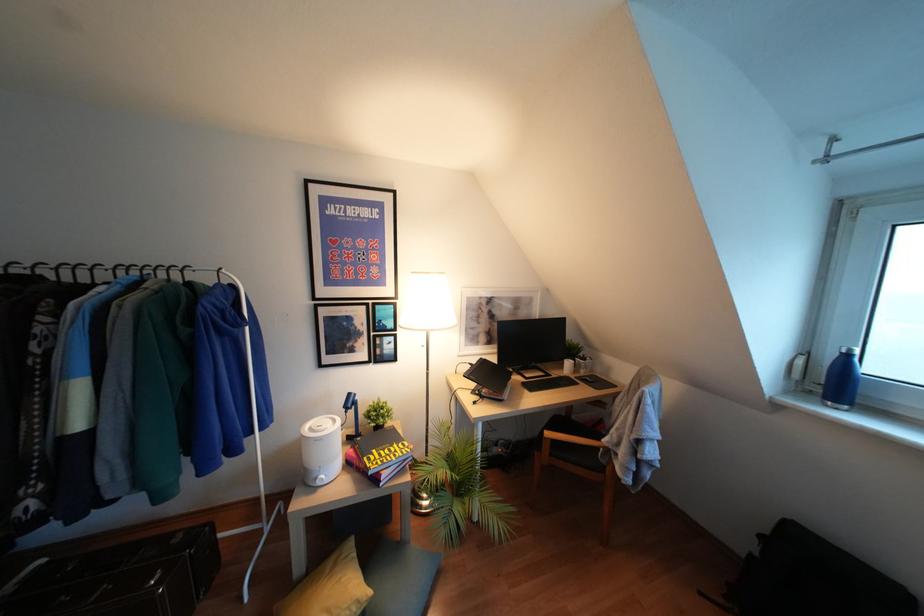
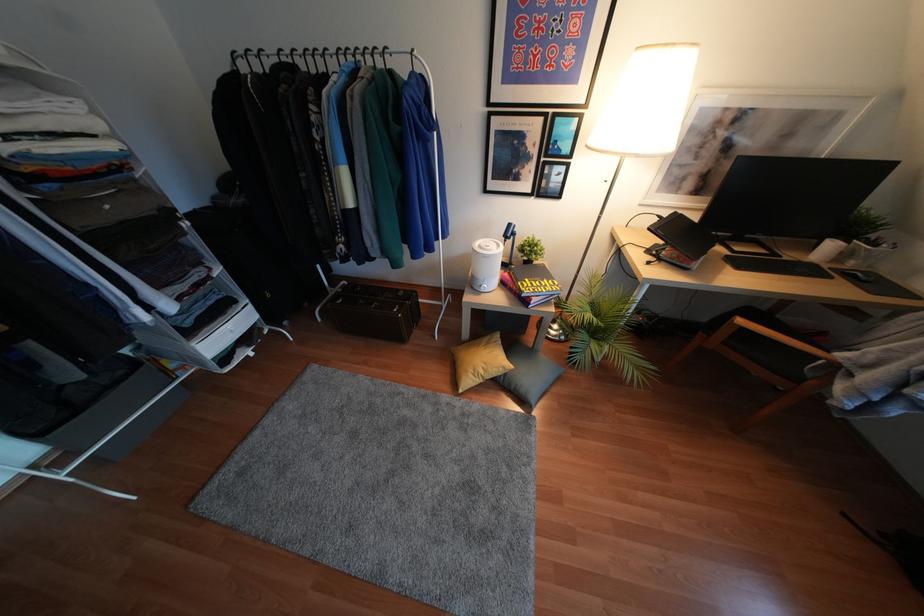
Find the pixel in the second image that matches point 120,273 in the first image.

(342, 59)